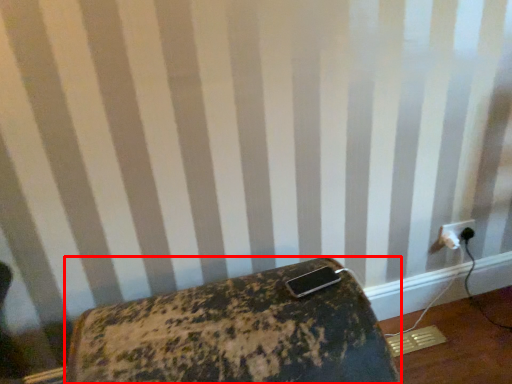
Question: From the image's perspective, where is furniture (annotated by the red box) located in relation to power plugs and sockets in the image?

Choices:
 (A) below
 (B) above

Answer: (A)